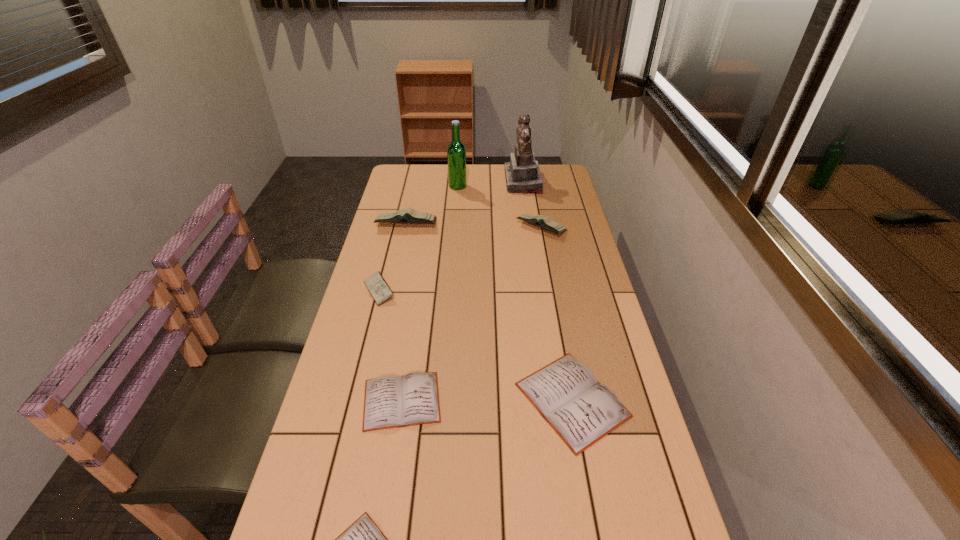
This screenshot has width=960, height=540. Find the location of `vacant space located on the front of the fifth tallest diary`. vacant space located on the front of the fifth tallest diary is located at coordinates (393, 462).

At what (x,y) coordinates should I click in order to perform the action: click on figurine at the far edge. Please return your answer as a coordinate pair (x, y). Looking at the image, I should click on (522, 173).

At what (x,y) coordinates should I click in order to perform the action: click on beer bottle that is positioned at the far edge. Please return your answer as a coordinate pair (x, y). The image size is (960, 540). Looking at the image, I should click on (456, 152).

The width and height of the screenshot is (960, 540). I want to click on figurine at the right edge, so click(x=522, y=173).

I want to click on object situated at the far right corner, so click(522, 173).

Identify the location of free space at the far edge. (480, 191).

In the image, there is a desktop. Where is `free space at the left edge`? The image size is (960, 540). free space at the left edge is located at coordinates (379, 261).

In the image, there is a desktop. In order to click on free space at the right edge in this screenshot , I will do `click(648, 486)`.

The image size is (960, 540). I want to click on free space at the far right corner, so click(x=567, y=185).

In order to click on vacant area that lies between the biggest pink diary and the second shortest diary in this screenshot , I will do `click(404, 312)`.